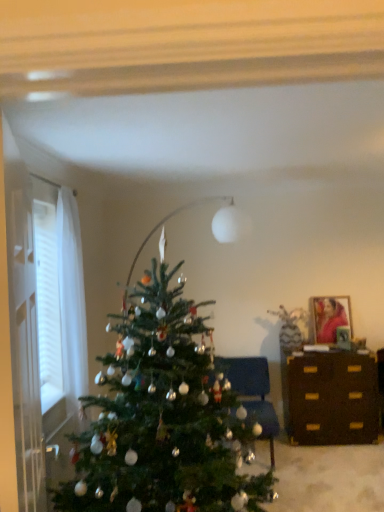
The image size is (384, 512). Describe the element at coordinates (253, 393) in the screenshot. I see `velvet blue chair at center` at that location.

At what (x,y) coordinates should I click in order to perform the action: click on velvet blue chair at center. Please return your answer as a coordinate pair (x, y). This screenshot has width=384, height=512. Looking at the image, I should click on (253, 393).

Would you consider dark brown wooden dresser at right to be distant from velvet blue chair at center?

No, dark brown wooden dresser at right is not far away from velvet blue chair at center.

Which is behind, dark brown wooden dresser at right or velvet blue chair at center?

dark brown wooden dresser at right is more distant.

Can you tell me how much dark brown wooden dresser at right and velvet blue chair at center differ in facing direction?

The angle between the facing direction of dark brown wooden dresser at right and the facing direction of velvet blue chair at center is 0.739 degrees.

I want to click on desk behind the velvet blue chair at center, so click(331, 398).

Is matte wooden picture frame at upper right wider or thinner than white sheer curtain at left?

In the image, matte wooden picture frame at upper right appears to be more narrow than white sheer curtain at left.

Is white sheer curtain at left inside matte wooden picture frame at upper right?

No.

Is matte wooden picture frame at upper right facing away from white sheer curtain at left?

That's not correct — matte wooden picture frame at upper right is not looking away from white sheer curtain at left.

Does velvet blue chair at center turn towards white sheer curtain at left?

No, velvet blue chair at center is not turned towards white sheer curtain at left.

Consider the image. Which point is more distant from viewer, [268,387] or [56,407]?

The point [268,387] is farther from the camera.

From the image's perspective, which one is positioned higher, velvet blue chair at center or white sheer curtain at left?

From the image's view, white sheer curtain at left is above.

Which is more to the left, velvet blue chair at center or white sheer curtain at left?

white sheer curtain at left is more to the left.

In the scene shown: Considering the sizes of white sheer curtain at left and velvet blue chair at center in the image, is white sheer curtain at left wider or thinner than velvet blue chair at center?

white sheer curtain at left is thinner than velvet blue chair at center.

The width and height of the screenshot is (384, 512). Find the location of `furniture lying behind the white sheer curtain at left`. furniture lying behind the white sheer curtain at left is located at coordinates [x=253, y=393].

Considering the points (30, 196) and (246, 366), which point is behind, point (30, 196) or point (246, 366)?

The point (246, 366) is more distant.

Is white sheer curtain at left far away from velvet blue chair at center?

Yes, white sheer curtain at left and velvet blue chair at center are located far from each other.

Which is in front, point (10, 170) or point (315, 328)?

Point (10, 170)

Identify the location of picture frame on the right of white sheer curtain at left. (330, 317).

How different are the orientations of white sheer curtain at left and matte wooden picture frame at upper right in degrees?

93.4 degrees.

From the image's perspective, is white sheer curtain at left located above or below matte wooden picture frame at upper right?

Clearly, from the image's perspective, white sheer curtain at left is above matte wooden picture frame at upper right.

Which object is thinner, green matte christmas tree at center or dark brown wooden dresser at right?

dark brown wooden dresser at right.

Which of these two, green matte christmas tree at center or dark brown wooden dresser at right, is smaller?

Smaller between the two is dark brown wooden dresser at right.

Is point (110, 462) closer or farther from the camera than point (282, 373)?

Point (110, 462) is closer to the camera than point (282, 373).

Between green matte christmas tree at center and dark brown wooden dresser at right, which one has more height?

green matte christmas tree at center.

Is dark brown wooden dresser at right directly adjacent to matte wooden picture frame at upper right?

No, dark brown wooden dresser at right is not making contact with matte wooden picture frame at upper right.

In terms of size, does dark brown wooden dresser at right appear bigger or smaller than matte wooden picture frame at upper right?

Considering their sizes, dark brown wooden dresser at right takes up more space than matte wooden picture frame at upper right.

From the image's perspective, would you say dark brown wooden dresser at right is positioned over matte wooden picture frame at upper right?

Incorrect, from the image's perspective, dark brown wooden dresser at right is lower than matte wooden picture frame at upper right.

Which is in front, dark brown wooden dresser at right or matte wooden picture frame at upper right?

Positioned in front is dark brown wooden dresser at right.

Identify the location of furniture above the dark brown wooden dresser at right (from a real-world perspective). The width and height of the screenshot is (384, 512). (253, 393).

I want to click on window on the left side of matte wooden picture frame at upper right, so click(x=44, y=329).

Which object lies further to the anchor point velvet blue chair at center, green matte christmas tree at center or dark brown wooden dresser at right?

green matte christmas tree at center is further to velvet blue chair at center.

Looking at the image, which one is located closer to dark brown wooden dresser at right, green matte christmas tree at center or matte wooden picture frame at upper right?

Based on the image, matte wooden picture frame at upper right appears to be nearer to dark brown wooden dresser at right.

Which object lies nearer to the anchor point green matte christmas tree at center, white sheer curtain at left or matte wooden picture frame at upper right?

The object closer to green matte christmas tree at center is white sheer curtain at left.

Which object lies nearer to the anchor point green matte christmas tree at center, velvet blue chair at center or white sheer curtain at left?

white sheer curtain at left is positioned closer to the anchor green matte christmas tree at center.

Estimate the real-world distances between objects in this image. Which object is closer to white sheer curtain at left, matte wooden picture frame at upper right or dark brown wooden dresser at right?

Among the two, dark brown wooden dresser at right is located nearer to white sheer curtain at left.

Based on the photo, looking at the image, which one is located further to matte wooden picture frame at upper right, green matte christmas tree at center or white sheer curtain at left?

Based on the image, white sheer curtain at left appears to be further to matte wooden picture frame at upper right.

Which object lies nearer to the anchor point white sheer curtain at left, green matte christmas tree at center or matte wooden picture frame at upper right?

green matte christmas tree at center is closer to white sheer curtain at left.

Based on the photo, estimate the real-world distances between objects in this image. Which object is closer to white sheer curtain at left, dark brown wooden dresser at right or velvet blue chair at center?

Based on the image, velvet blue chair at center appears to be nearer to white sheer curtain at left.

Locate an element on the screen. This screenshot has height=512, width=384. furniture positioned between white sheer curtain at left and matte wooden picture frame at upper right from near to far is located at coordinates (253, 393).

Find the location of a particular element. This screenshot has width=384, height=512. furniture located between white sheer curtain at left and dark brown wooden dresser at right in the depth direction is located at coordinates (253, 393).

Where is `furniture between green matte christmas tree at center and matte wooden picture frame at upper right along the z-axis`? The width and height of the screenshot is (384, 512). furniture between green matte christmas tree at center and matte wooden picture frame at upper right along the z-axis is located at coordinates (253, 393).

Locate an element on the screen. desk located between green matte christmas tree at center and matte wooden picture frame at upper right in the depth direction is located at coordinates (331, 398).